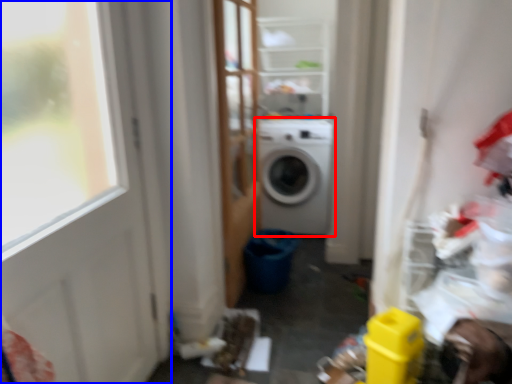
Question: Which point is further to the camera, washing machine (highlighted by a red box) or door (highlighted by a blue box)?

Choices:
 (A) washing machine
 (B) door

Answer: (A)